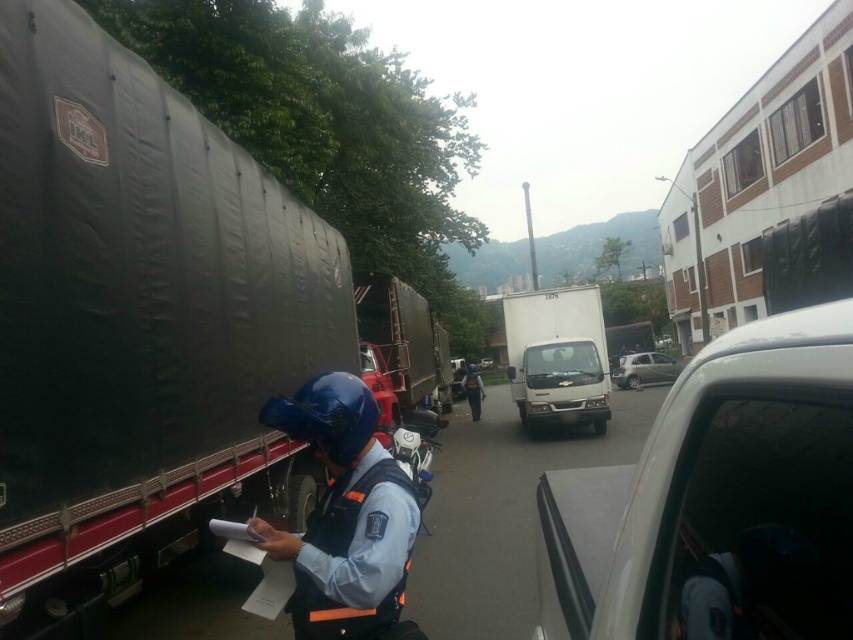
From the picture: You are a pedestrian standing at the point marked by the coordinate point (717, 500). Which direction should you walk to reach the white pickup truck?

The white pickup truck is located to the right of the point marked by the coordinate point (717, 500). Therefore, you should walk to the right to reach it.

You are a pedestrian standing on the sidewalk and see the dark matte trailer truck at left and the dark blue uniform at center. Which object is higher in the image?

The dark matte trailer truck at left is higher in the image than the dark blue uniform at center.

Consider the image. You are a delivery person who needs to place a package between the blue hard hat at center and the silver metallic car at center. The package requires a minimum of 80 feet of space to fit. Do you think there is enough space between them?

The blue hard hat at center and the silver metallic car at center are 76.09 feet apart. Since the required space is 80 feet, there is insufficient space to place the package between them.